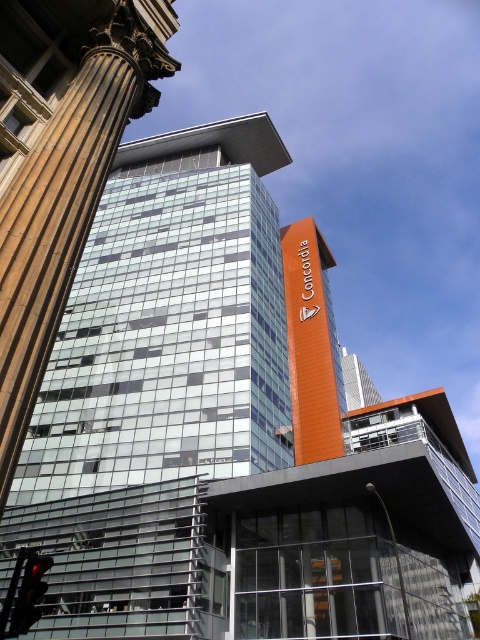
Does orange matte sign at upper center come behind red glass traffic light at lower left?

That is True.

Does point (288, 296) come farther from viewer compared to point (25, 592)?

Yes.

Identify the location of orange matte sign at upper center. Image resolution: width=480 pixels, height=640 pixels. (310, 344).

Is point (10, 420) positioned before point (26, 605)?

That is True.

Which is below, brown polished stone column at left or red glass traffic light at lower left?

red glass traffic light at lower left is below.

Between point (25, 115) and point (21, 602), which one is positioned behind?

Point (25, 115)

This screenshot has width=480, height=640. Find the location of `brown polished stone column at left`. brown polished stone column at left is located at coordinates (62, 170).

Between point (34, 67) and point (324, 368), which one is positioned behind?

Positioned behind is point (324, 368).

Image resolution: width=480 pixels, height=640 pixels. Describe the element at coordinates (62, 170) in the screenshot. I see `brown polished stone column at left` at that location.

You are a GUI agent. You are given a task and a screenshot of the screen. Output one action in this format:
    pyautogui.click(x=<x>, y=<y>)
    Task: Click on the brown polished stone column at left
    This screenshot has width=480, height=640.
    Given the screenshot: What is the action you would take?
    pyautogui.click(x=62, y=170)

Where is `brown polished stone column at left`? This screenshot has height=640, width=480. brown polished stone column at left is located at coordinates (62, 170).